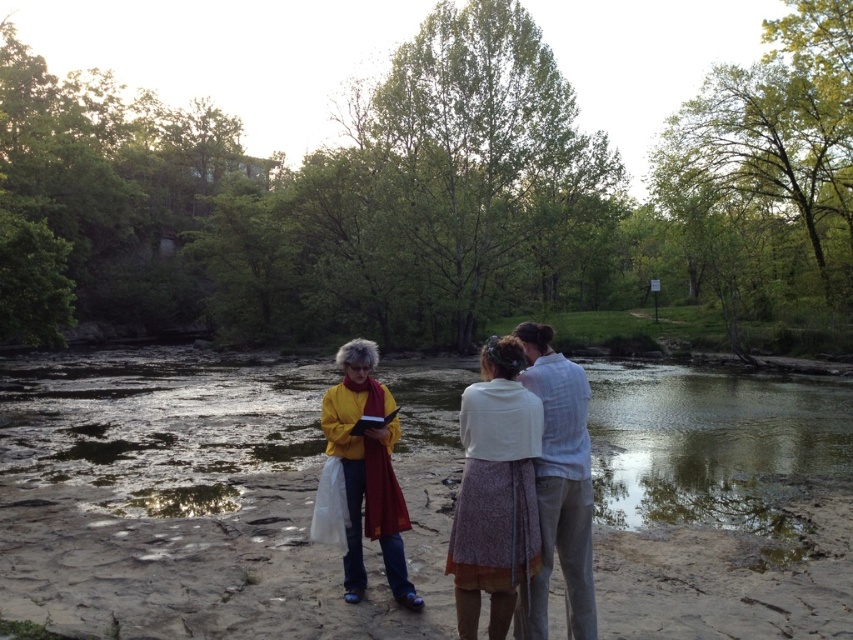
Based on the scene description, which clothing item is closer to the viewer? The white textured blouse at center or the light blue cotton shirt at center?

The white textured blouse at center is closer to the viewer because it is positioned under the light blue cotton shirt at center, meaning it is layered in front.

You are standing at the riverbank and want to place a small marker at the closest point to you between point (492, 630) and point (398, 493). Which point should you choose?

Point (492, 630) is closer to the viewer than point (398, 493), so you should choose point (492, 630).

You are organizing a clothing donation drive and need to determine which item takes up less space. Based on the scene, which clothing item between the white textured blouse at center and the yellow matte sweater at center is more suitable for packing efficiently?

The white textured blouse at center is thinner than the yellow matte sweater at center, so it takes up less space and is more suitable for packing efficiently.